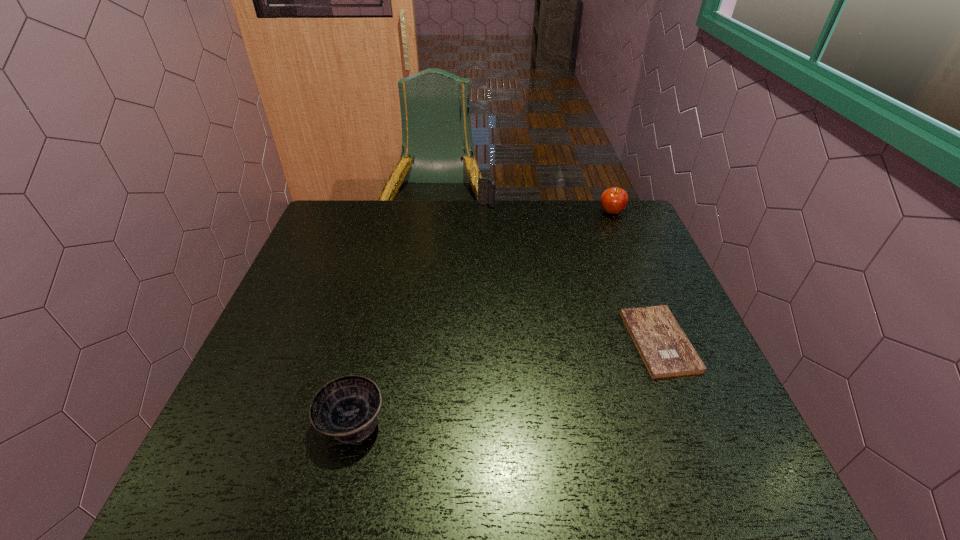
What are the coordinates of `cellular telephone` in the screenshot? It's located at (486, 187).

Locate an element on the screen. the tallest object is located at coordinates (486, 187).

Identify the location of the second tallest object. The image size is (960, 540). (613, 200).

Find the location of `the third tallest object`. the third tallest object is located at coordinates pos(346,408).

The height and width of the screenshot is (540, 960). In order to click on the leftmost object in this screenshot , I will do `click(346, 408)`.

Find the location of `Bible`. Bible is located at coordinates (666, 351).

Find the location of `the shortest object`. the shortest object is located at coordinates (666, 351).

You are a GUI agent. You are given a task and a screenshot of the screen. Output one action in this format:
    pyautogui.click(x=<x>, y=<y>)
    Task: Click on the vacant space situated on the keyboard of the tallest object
    Image resolution: width=960 pixels, height=540 pixels.
    Given the screenshot: What is the action you would take?
    pyautogui.click(x=487, y=231)

Locate an element on the screen. vacant space located 0.330m on the front of the second tallest object is located at coordinates (643, 288).

Find the location of a particular element. The image size is (960, 540). vacant region located 0.400m on the right of the leftmost object is located at coordinates (586, 421).